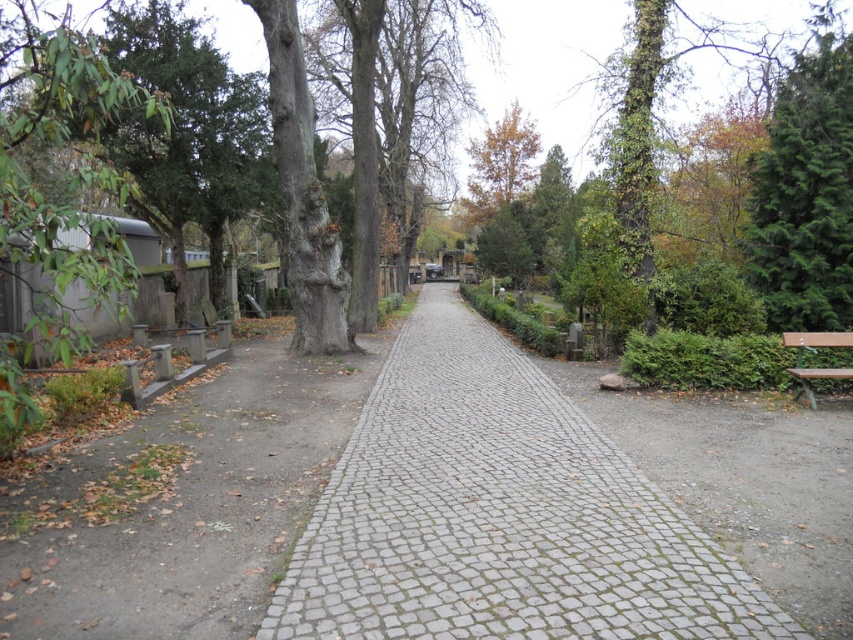
You are standing at the camera position and want to take a photo of the green textured evergreen tree at right. The camera has a maximum focus range of 40 feet. Will the tree be in focus?

The green textured evergreen tree at right is 39.63 feet away from the camera, which is within the camera maximum focus range of 40 feet. Therefore, the tree will be in focus.